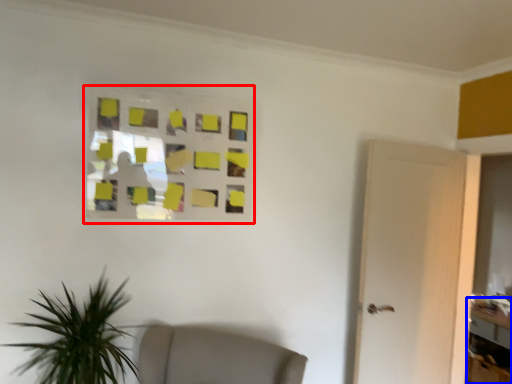
Question: Among these objects, which one is farthest to the camera, glass window (highlighted by a red box) or table (highlighted by a blue box)?

Choices:
 (A) glass window
 (B) table

Answer: (B)